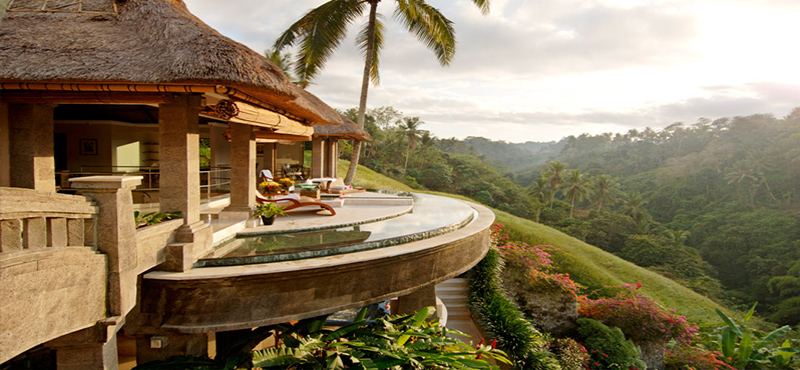
Locate an element on the screen. This screenshot has height=370, width=800. columns is located at coordinates (176, 145), (240, 175), (314, 169), (330, 166), (46, 163).